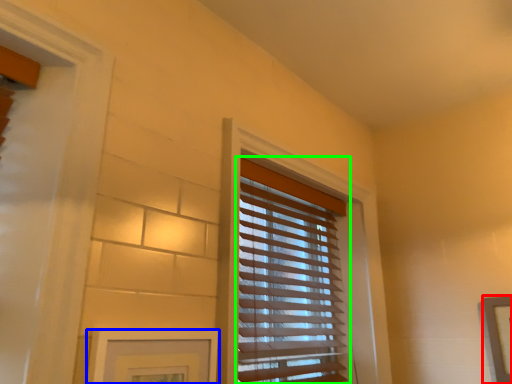
Question: Considering the real-world distances, which object is closest to picture frame (highlighted by a red box)? picture frame (highlighted by a blue box) or window blind (highlighted by a green box).

Choices:
 (A) picture frame
 (B) window blind

Answer: (B)